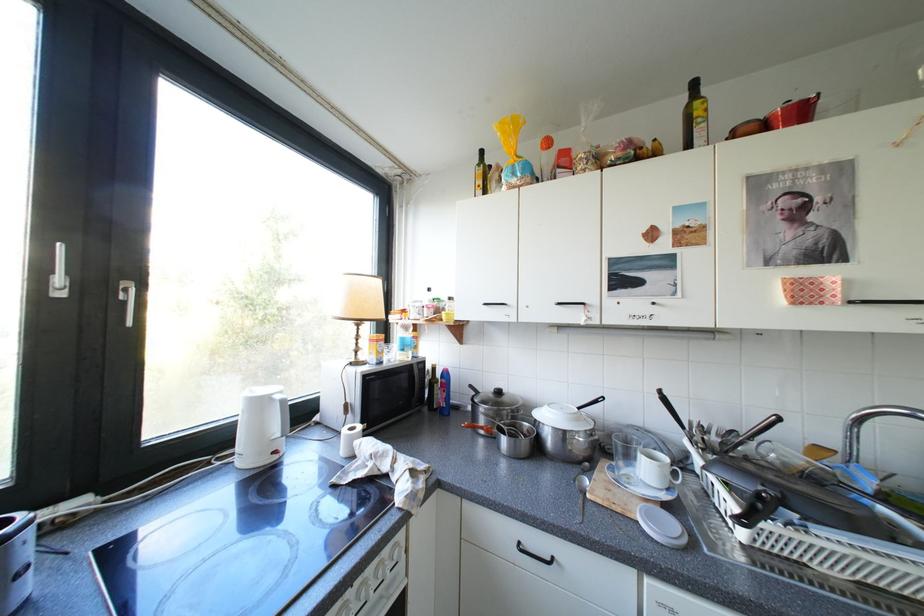
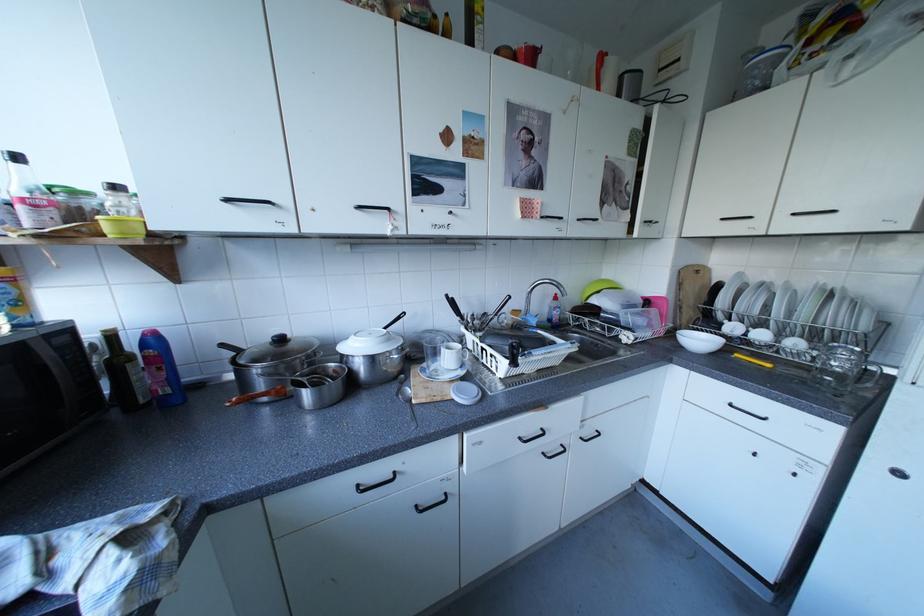
Locate, in the second image, the point that corresponds to (x=590, y=418) in the first image.

(400, 338)